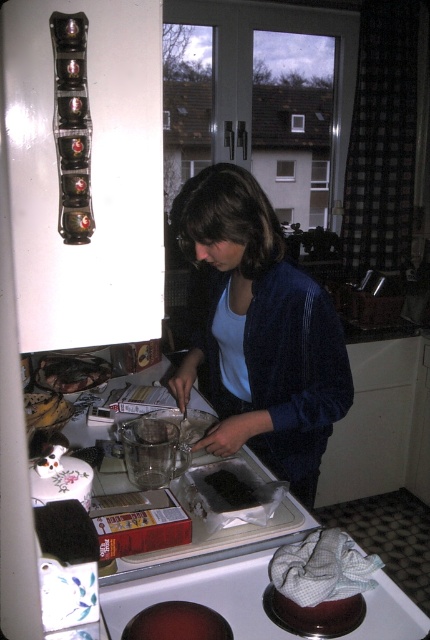
Question: Does dark brown cake at lower center have a lesser width compared to brown crumbly cake at lower left?

Choices:
 (A) no
 (B) yes

Answer: (B)

Question: Which point is closer to the camera taking this photo?

Choices:
 (A) (186, 620)
 (B) (239, 278)
 (C) (242, 486)

Answer: (A)

Question: Which point is farther from the camera taking this photo?

Choices:
 (A) (220, 492)
 (B) (279, 289)
 (C) (132, 621)
 (D) (67, 387)

Answer: (D)

Question: Is the position of dark matte chocolate at center more distant than that of brown crumbly cake at lower left?

Choices:
 (A) yes
 (B) no

Answer: (B)

Question: Is dark brown cake at lower center below brown crumbly cake at lower left?

Choices:
 (A) no
 (B) yes

Answer: (B)

Question: Which point is closer to the camera taking this photo?

Choices:
 (A) (77, 376)
 (B) (180, 608)

Answer: (B)